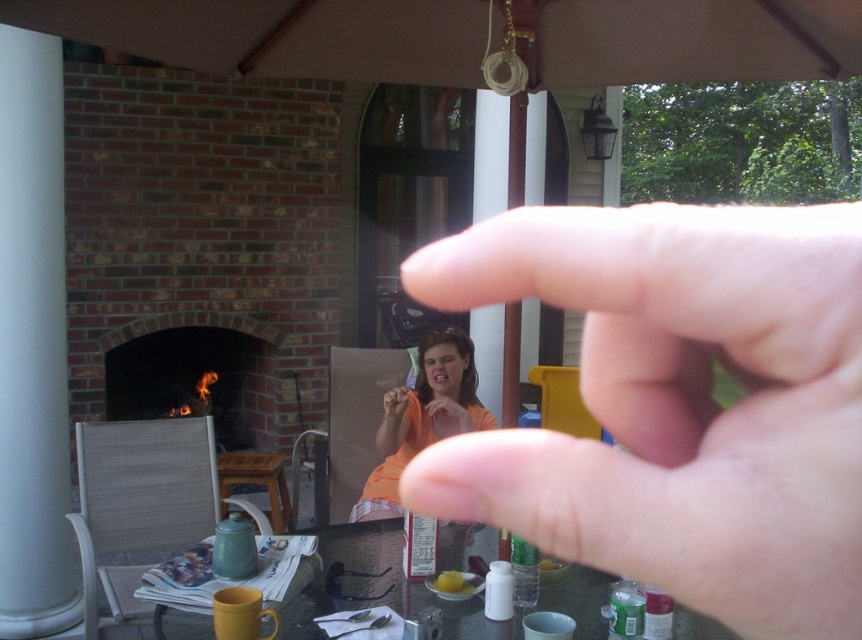
You are standing at the point labeled as point [200,344] in the image. If you want to take a photo of the brick fireplace with the white column and glass door in the background, will you be able to capture the entire scene without moving your position?

The distance between you and the point [200,344] is 17.61 feet. Since you are already at that point, you can capture the entire scene of the brick fireplace with the white column and glass door in the background without needing to move.

You are standing at the center of the patio and see the point marked at coordinates [678,404]. What is located at that point?

The point at coordinates [678,404] corresponds to flesh toned skin at center.